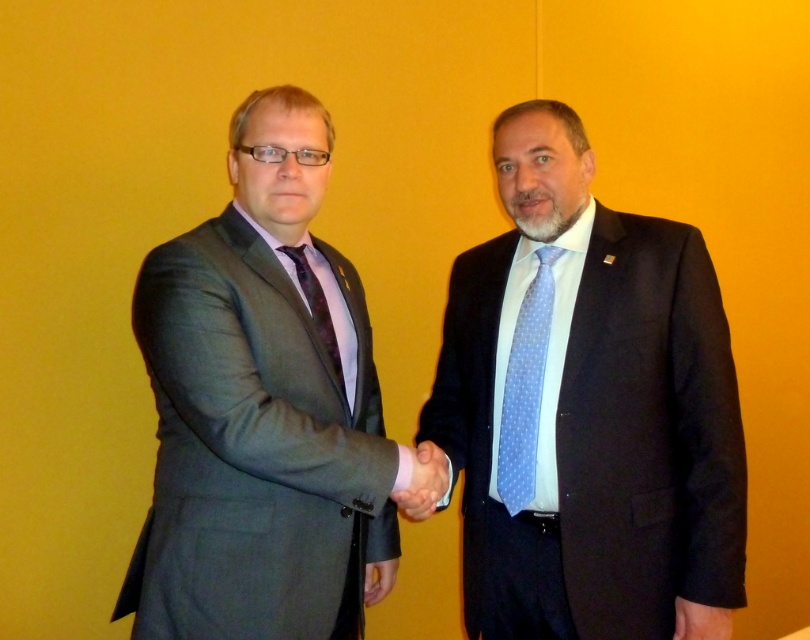
You are a photographer who needs to adjust the lighting to ensure both the blue dotted fabric tie at center and the matte purple tie at center are clearly visible. Which tie is closer to the camera and should be lit more intensely to prevent the one behind from being overshadowed?

The blue dotted fabric tie at center is closer to the camera since the matte purple tie at center is behind it. Therefore, the blue dotted fabric tie at center should be lit more intensely to ensure it doesn not block the visibility of the matte purple tie at center.